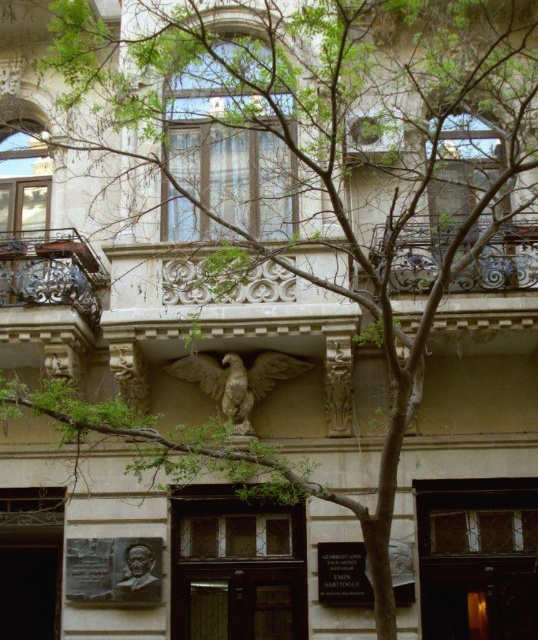
Question: Is stone eagle at center above bronze relief at lower center?

Choices:
 (A) no
 (B) yes

Answer: (B)

Question: Among these points, which one is nearest to the camera?

Choices:
 (A) (275, 356)
 (B) (116, 589)
 (C) (24, 291)
 (D) (69, 301)

Answer: (B)

Question: From the image, what is the correct spatial relationship of stone eagle at center in relation to bronze relief at lower center?

Choices:
 (A) above
 (B) below

Answer: (A)

Question: Among these objects, which one is farthest from the camera?

Choices:
 (A) dark brown wrought iron balcony at left
 (B) dark brown ornate metalwork at left
 (C) bronze relief at lower center

Answer: (B)

Question: Does dark brown wrought iron balcony at left have a lesser width compared to bronze relief at lower center?

Choices:
 (A) yes
 (B) no

Answer: (B)

Question: Which point is closer to the camera?

Choices:
 (A) (60, 276)
 (B) (222, 406)

Answer: (A)